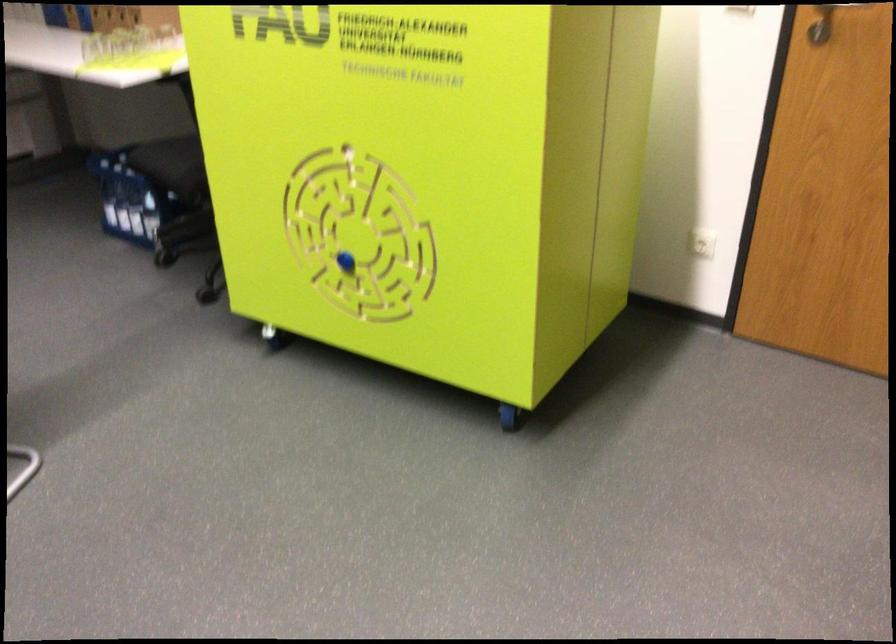
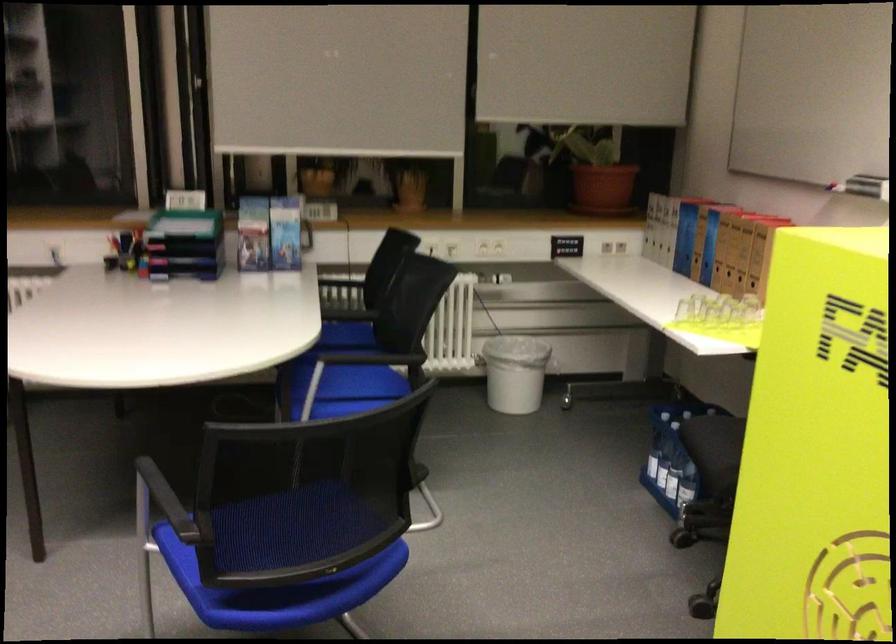
Where in the second image is the point corresponding to [113,207] from the first image?

(650, 458)